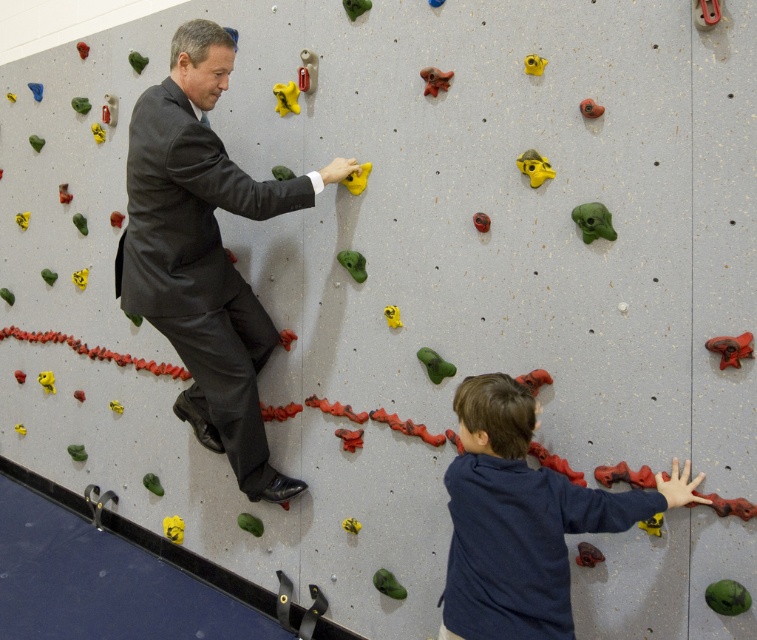
Is point (182, 200) behind point (522, 611)?

Yes, point (182, 200) is farther from viewer.

Who is more forward, (187,195) or (606,490)?

Point (606,490) is in front.

Who is more forward, (198, 401) or (459, 461)?

Point (459, 461)

Locate an element on the screen. The height and width of the screenshot is (640, 757). dark gray suit at center is located at coordinates (201, 269).